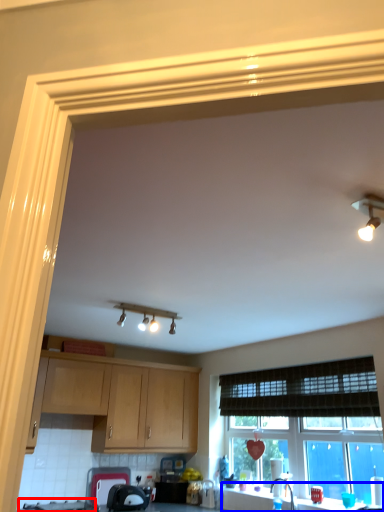
Question: Which of the following is the closest to the observer, gas stove (highlighted by a red box) or counter top (highlighted by a blue box)?

Choices:
 (A) gas stove
 (B) counter top

Answer: (B)